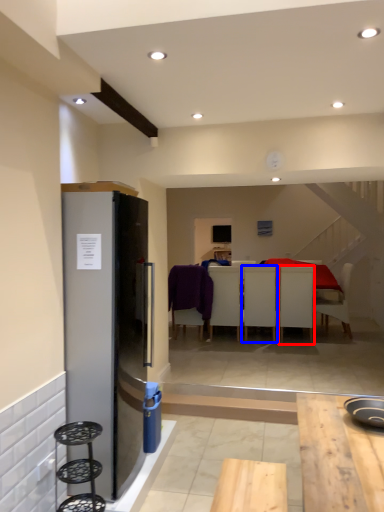
Question: Which object appears farthest to the camera in this image, chair (highlighted by a red box) or chair (highlighted by a blue box)?

Choices:
 (A) chair
 (B) chair

Answer: (B)